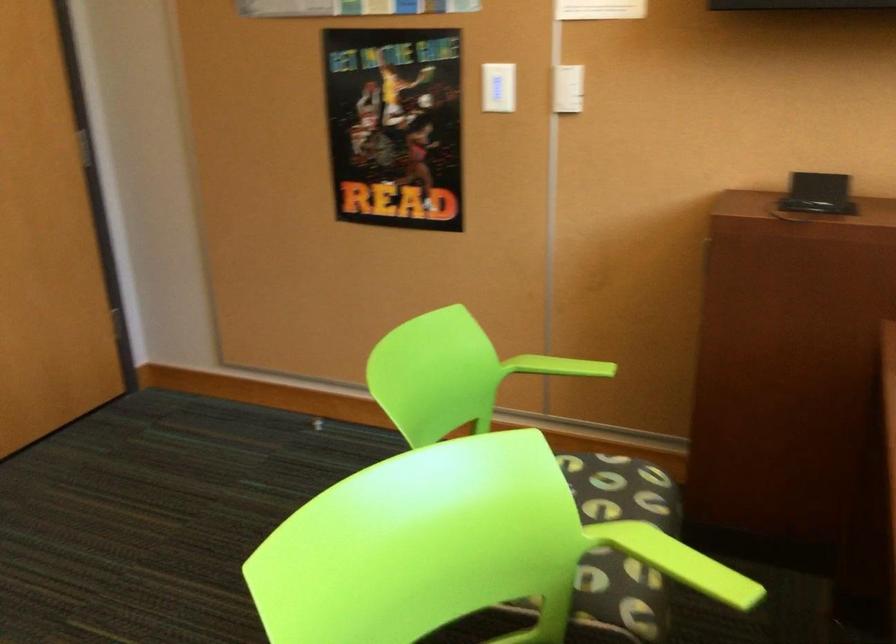
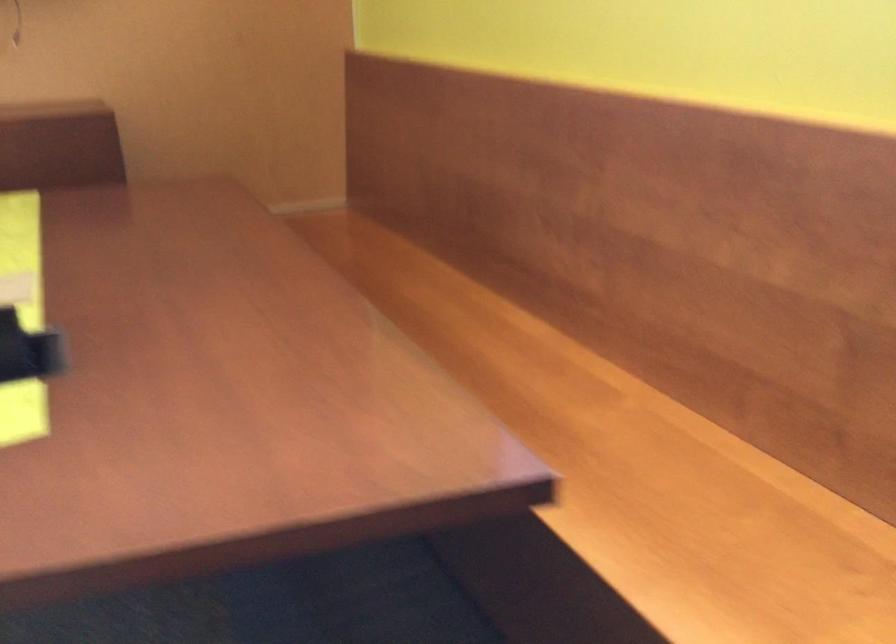
Question: The camera is either moving clockwise (left) or counter-clockwise (right) around the object. The first image is from the beginning of the video and the second image is from the end. Is the camera moving left or right when shooting the video?

Choices:
 (A) Left
 (B) Right

Answer: (A)